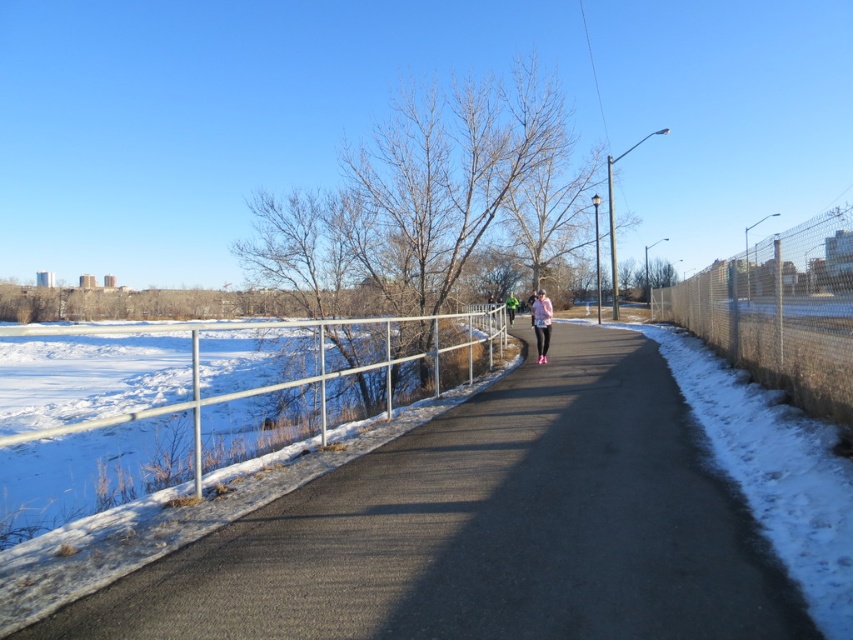
Question: Is asphalt road at center to the left of pink fabric pants at center from the viewer's perspective?

Choices:
 (A) yes
 (B) no

Answer: (A)

Question: Which point is closer to the camera taking this photo?

Choices:
 (A) (535, 328)
 (B) (70, 632)

Answer: (B)

Question: In this image, where is asphalt road at center located relative to pink fabric pants at center?

Choices:
 (A) below
 (B) above

Answer: (A)

Question: Is the position of asphalt road at center less distant than that of pink fabric pants at center?

Choices:
 (A) yes
 (B) no

Answer: (A)